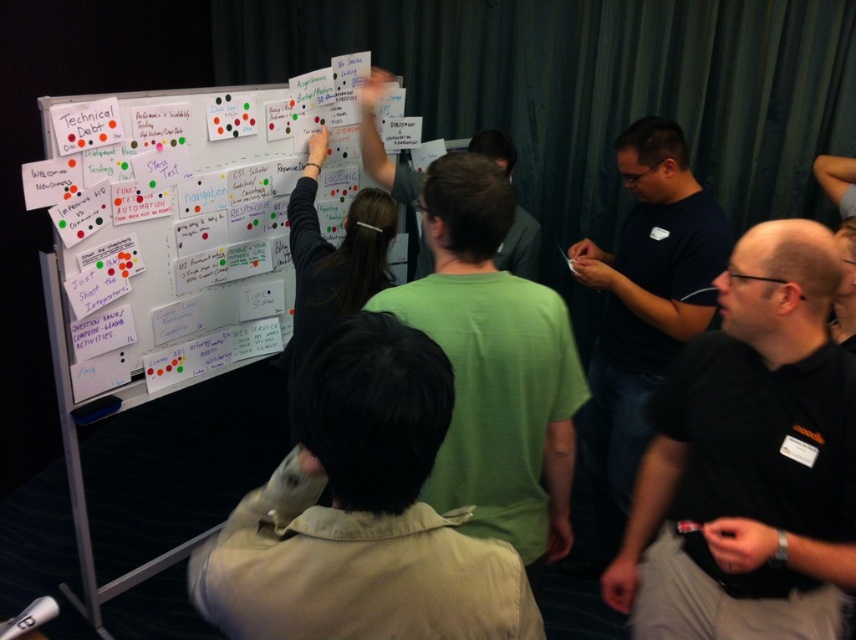
Question: Which point appears farthest from the camera in this image?

Choices:
 (A) (486, 621)
 (B) (539, 340)
 (C) (673, 412)
 (D) (629, 388)

Answer: (D)

Question: Does khaki cotton shirt at center have a smaller size compared to green matte shirt at upper center?

Choices:
 (A) no
 (B) yes

Answer: (A)

Question: Can you confirm if black shirt at lower right is positioned to the right of green matte shirt at upper center?

Choices:
 (A) no
 (B) yes

Answer: (B)

Question: Which point is closer to the camera?

Choices:
 (A) (496, 420)
 (B) (370, 355)
 (C) (224, 360)

Answer: (B)

Question: Which point is closer to the camera taking this photo?

Choices:
 (A) (476, 435)
 (B) (403, 189)
 (C) (798, 348)
 (D) (123, 225)

Answer: (C)

Question: Is the position of green cotton t-shirt at center more distant than that of green matte shirt at upper center?

Choices:
 (A) yes
 (B) no

Answer: (B)